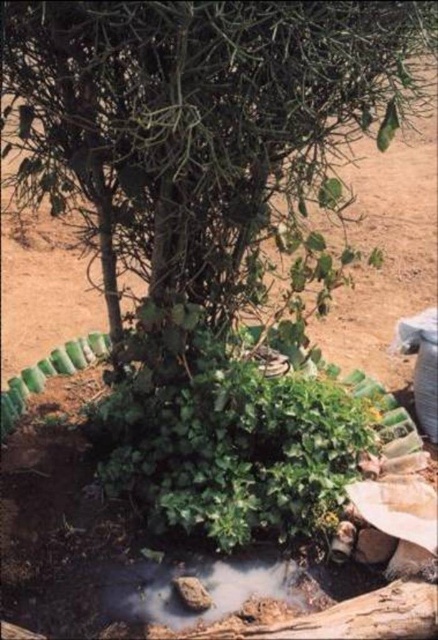
Question: Does green matte tree at center have a greater width compared to brown dirt puddle at lower center?

Choices:
 (A) no
 (B) yes

Answer: (B)

Question: Can you confirm if green matte tree at center is wider than brown dirt puddle at lower center?

Choices:
 (A) no
 (B) yes

Answer: (B)

Question: Which object is closer to the camera taking this photo?

Choices:
 (A) green matte tree at center
 (B) brown dirt puddle at lower center

Answer: (A)

Question: Is green matte tree at center below brown dirt puddle at lower center?

Choices:
 (A) yes
 (B) no

Answer: (B)